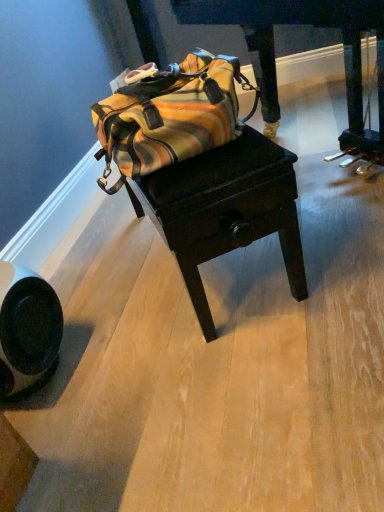
I want to click on vacant area to the right of wooden table at center, so (x=330, y=207).